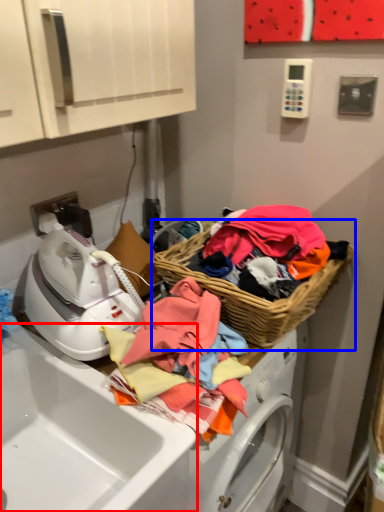
Question: Which point is closer to the camera, sink (highlighted by a red box) or picnic basket (highlighted by a blue box)?

Choices:
 (A) sink
 (B) picnic basket

Answer: (A)